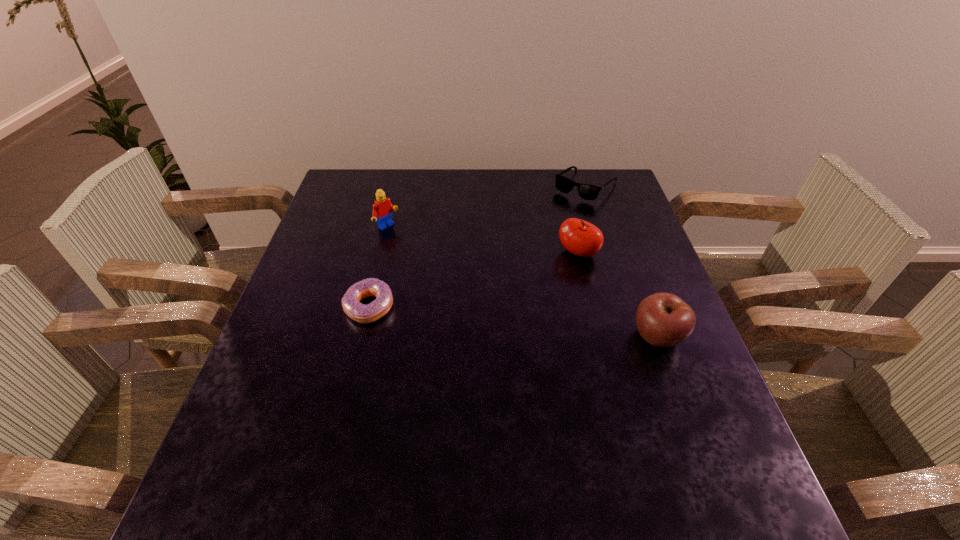
The width and height of the screenshot is (960, 540). Identify the location of vacant region between the sunglasses and the third nearest object. (582, 219).

Identify the location of vacant space that is in between the doughnut and the right apple. (514, 322).

You are a GUI agent. You are given a task and a screenshot of the screen. Output one action in this format:
    pyautogui.click(x=<x>, y=<y>)
    Task: Click on the empty space that is in between the Lego and the farther apple
    The width and height of the screenshot is (960, 540).
    Given the screenshot: What is the action you would take?
    pyautogui.click(x=483, y=240)

Identify the location of free spot between the doughnut and the third farthest object. This screenshot has height=540, width=960. (473, 280).

Identify the location of vacant space that's between the fourth nearest object and the doughnut. (378, 267).

The width and height of the screenshot is (960, 540). Identify the location of vacant space that is in between the nearer apple and the sunglasses. (622, 261).

At what (x,y) coordinates should I click in order to perform the action: click on free spot between the second farthest object and the left apple. Please return your answer as a coordinate pair (x, y). The width and height of the screenshot is (960, 540). Looking at the image, I should click on (483, 240).

You are a GUI agent. You are given a task and a screenshot of the screen. Output one action in this format:
    pyautogui.click(x=<x>, y=<y>)
    Task: Click on the empty space that is in between the second farthest object and the nearer apple
    This screenshot has width=960, height=540.
    Given the screenshot: What is the action you would take?
    pyautogui.click(x=522, y=282)

Where is `vacant space that's between the third shortest object and the sunglasses`? Image resolution: width=960 pixels, height=540 pixels. vacant space that's between the third shortest object and the sunglasses is located at coordinates (622, 261).

In order to click on free space that is in between the farthest object and the second farthest object in this screenshot , I will do `click(487, 207)`.